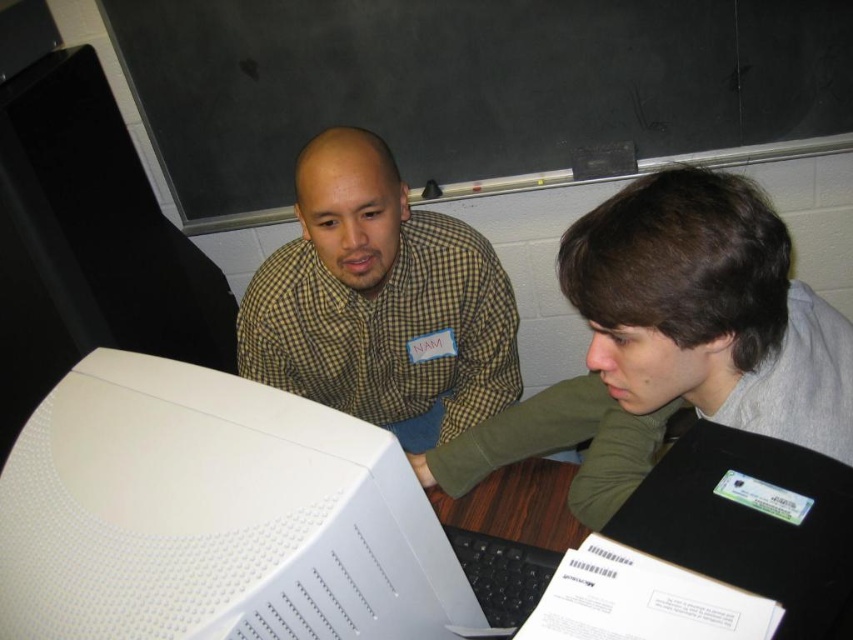
Based on the photo, what color is the fabric at the point marked by coordinates (672, 342)?

The fabric at the point marked by coordinates (672, 342) is gray and green.

What object is located at the coordinates point (213, 516)?

The white textured monitor at lower left is located at point (213, 516).